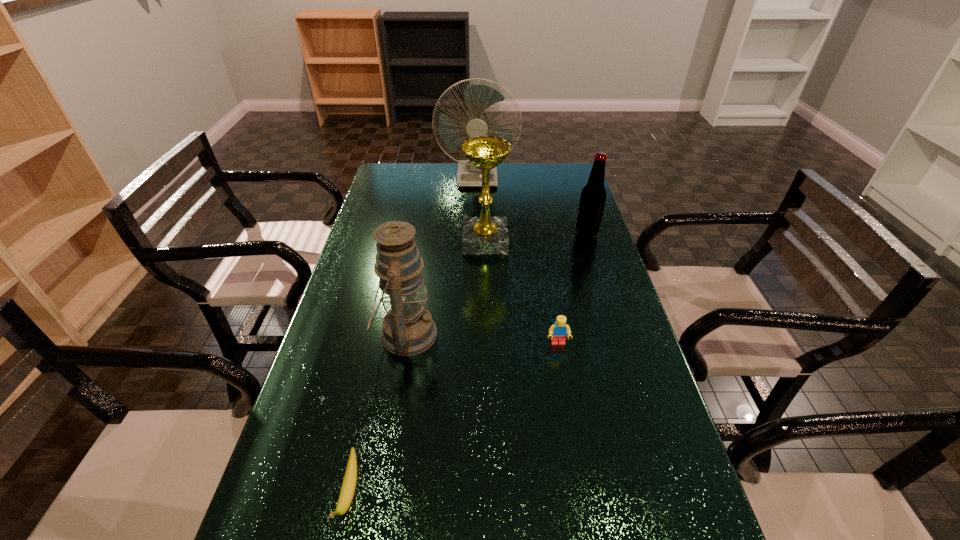
Locate an element on the screen. This screenshot has height=540, width=960. object that stands as the second closest to the Lego is located at coordinates (481, 235).

Identify which object is the second nearest to the rightmost object. Please provide its 2D coordinates. Your answer should be formatted as a tuple, i.e. [(x, y)], where the tuple contains the x and y coordinates of a point satisfying the conditions above.

[(478, 98)]

This screenshot has width=960, height=540. I want to click on vacant space that satisfies the following two spatial constraints: 1. on the front-facing side of the beer bottle; 2. on the left side of the farthest object, so click(x=477, y=233).

I want to click on free location that satisfies the following two spatial constraints: 1. on the front-facing side of the award; 2. at the stem of the nearest object, so click(489, 493).